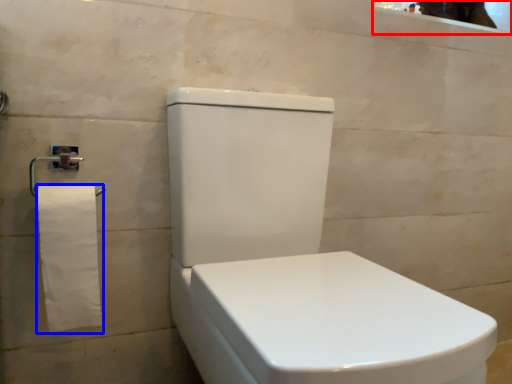
Question: Which of the following is the closest to the observer, mirror (highlighted by a red box) or toilet paper (highlighted by a blue box)?

Choices:
 (A) mirror
 (B) toilet paper

Answer: (B)